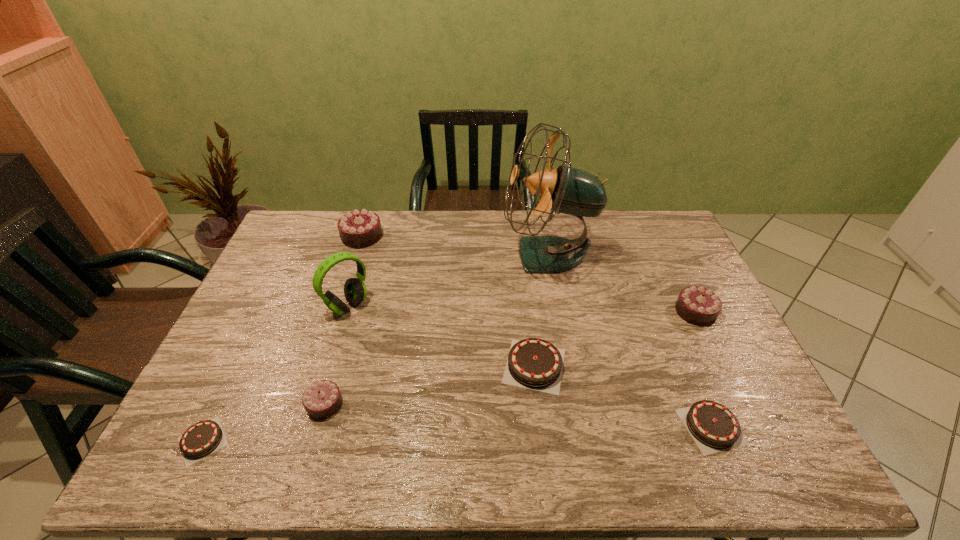
The height and width of the screenshot is (540, 960). Identify the location of the farthest brown chocolate cake. (533, 363).

Identify the location of the second biggest brown chocolate cake. (714, 428).

Where is `the rightmost brown chocolate cake`? The height and width of the screenshot is (540, 960). the rightmost brown chocolate cake is located at coordinates (714, 428).

The height and width of the screenshot is (540, 960). Identify the location of the shortest object. (203, 438).

Find the location of a particular element. This screenshot has width=960, height=540. the leftmost object is located at coordinates (203, 438).

The height and width of the screenshot is (540, 960). Find the location of `vacant position located on the front-facing side of the tallest object for air flow`. vacant position located on the front-facing side of the tallest object for air flow is located at coordinates point(393,255).

Locate an element on the screen. This screenshot has width=960, height=540. vacant region located on the front-facing side of the tallest object for air flow is located at coordinates (427, 255).

This screenshot has height=540, width=960. I want to click on vacant space located 0.120m on the front-facing side of the tallest object for air flow, so click(x=468, y=255).

Find the location of a particular element. free spot located on the left of the seventh shortest object is located at coordinates (275, 306).

Where is `vacant area situated on the front of the sixth shortest object`? The height and width of the screenshot is (540, 960). vacant area situated on the front of the sixth shortest object is located at coordinates (350, 274).